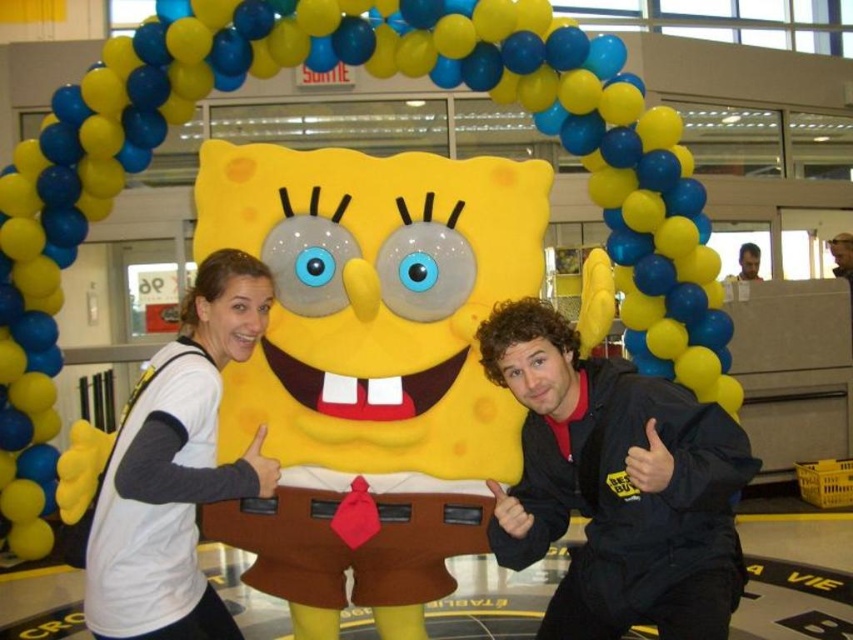
Who is more distant from viewer, (561, 525) or (750, 243)?

The point (750, 243) is behind.

Does point (544, 445) come farther from viewer compared to point (746, 250)?

No, it is not.

The height and width of the screenshot is (640, 853). Identify the location of black matte jacket at lower right. (616, 484).

Which is above, smooth leather jacket at upper right or smooth skin face at upper right?

smooth skin face at upper right

Is point (842, 268) more distant than point (750, 273)?

Yes, it is behind point (750, 273).

Identify the location of smooth leather jacket at upper right. The height and width of the screenshot is (640, 853). (840, 253).

Is black matte jacket at lower right closer to camera compared to smooth leather jacket at upper right?

Yes, it is in front of smooth leather jacket at upper right.

Which is behind, point (531, 403) or point (846, 275)?

The point (846, 275) is behind.

Between point (602, 500) and point (831, 241), which one is positioned behind?

Positioned behind is point (831, 241).

Where is `black matte jacket at lower right`? black matte jacket at lower right is located at coordinates (616, 484).